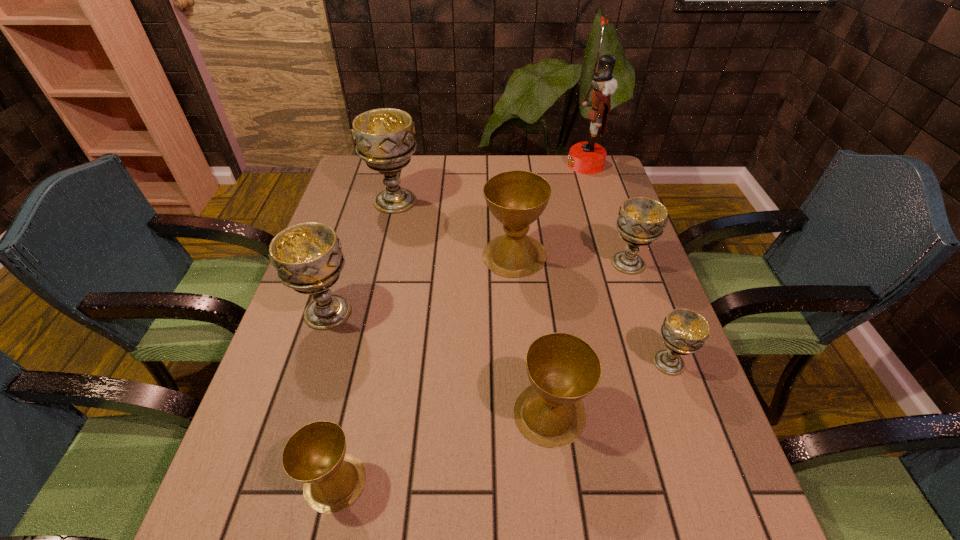
I want to click on vacant space located on the left of the second nearest chalice, so click(404, 414).

In order to click on vacant region located 0.300m on the back of the third nearest white chalice in this screenshot , I will do `click(603, 189)`.

Image resolution: width=960 pixels, height=540 pixels. Find the location of `vacant space located on the right of the nearest chalice`. vacant space located on the right of the nearest chalice is located at coordinates (509, 482).

This screenshot has width=960, height=540. Identify the location of free space located 0.110m on the back of the smallest white chalice. (650, 310).

This screenshot has height=540, width=960. I want to click on nutcracker positioned at the far edge, so click(589, 157).

This screenshot has height=540, width=960. What are the coordinates of `chalice that is at the far edge` in the screenshot? It's located at (384, 137).

Image resolution: width=960 pixels, height=540 pixels. What are the coordinates of `nutcracker that is at the right edge` in the screenshot? It's located at (589, 157).

The image size is (960, 540). I want to click on object positioned at the far left corner, so click(x=384, y=137).

You are a GUI agent. You are given a task and a screenshot of the screen. Output one action in this format:
    pyautogui.click(x=<x>, y=<y>)
    Task: Click on the object at the far right corner
    
    Given the screenshot: What is the action you would take?
    pyautogui.click(x=589, y=157)

Locate an element on the screen. Image resolution: width=960 pixels, height=540 pixels. vacant area at the far edge of the desktop is located at coordinates (507, 163).